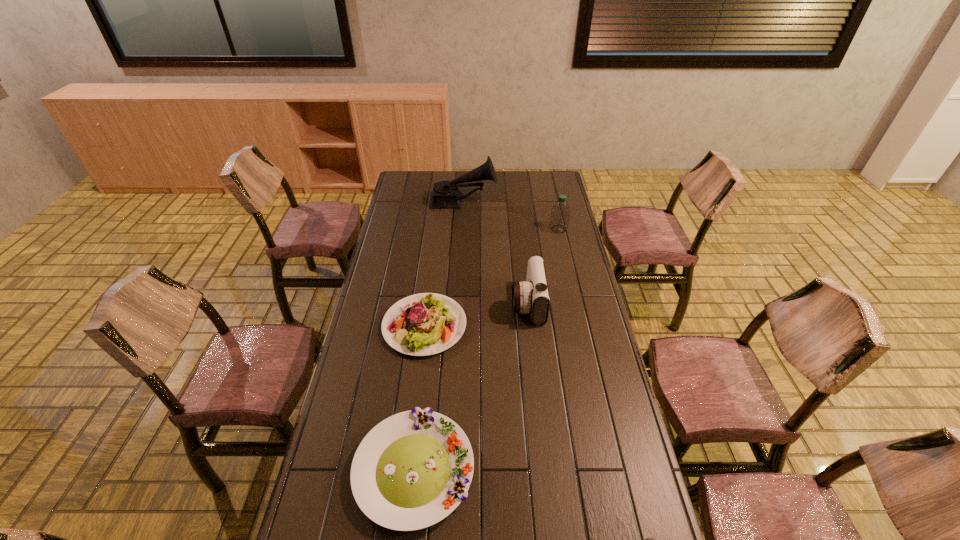
I want to click on vacant position located on the surface of the camcorder, so click(411, 303).

Where is `vacant region located 0.170m on the surface of the camcorder`? This screenshot has height=540, width=960. vacant region located 0.170m on the surface of the camcorder is located at coordinates (468, 303).

This screenshot has height=540, width=960. What are the coordinates of `vacant space located on the surface of the camcorder` in the screenshot? It's located at (479, 303).

Image resolution: width=960 pixels, height=540 pixels. What are the coordinates of `vacant space located 0.100m on the back of the farther salad plate` in the screenshot? It's located at (430, 280).

In order to click on free region located on the back of the second nearest object in this screenshot , I will do `click(427, 350)`.

The image size is (960, 540). What are the coordinates of `object present at the far edge` in the screenshot? It's located at (445, 194).

I want to click on object at the right edge, so click(560, 212).

Image resolution: width=960 pixels, height=540 pixels. Find the location of `vacant region at the far edge`. vacant region at the far edge is located at coordinates (517, 187).

What are the coordinates of `vacant point at the left edge` in the screenshot? It's located at (337, 438).

Image resolution: width=960 pixels, height=540 pixels. What are the coordinates of `free space at the right edge` in the screenshot? It's located at (593, 329).